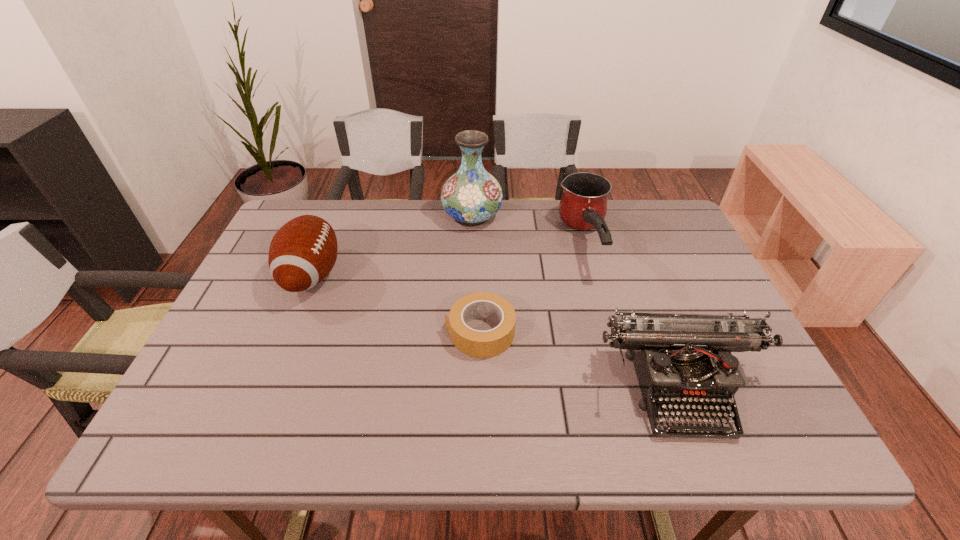
The image size is (960, 540). In the image, there is a desktop. In order to click on vacant space at the left edge in this screenshot , I will do `click(247, 287)`.

Locate an element on the screen. Image resolution: width=960 pixels, height=540 pixels. vacant region at the far right corner of the desktop is located at coordinates (668, 211).

Identify the location of free spot between the duct tape and the saucepan. The image size is (960, 540). (533, 287).

At what (x,y) coordinates should I click in order to perform the action: click on free space between the duct tape and the tallest object. Please return your answer as a coordinate pair (x, y). The image size is (960, 540). Looking at the image, I should click on (476, 274).

In order to click on free space between the saucepan and the leftmost object in this screenshot , I will do pos(448,259).

Where is `vacant area that lies between the typewriter and the tallest object`? The width and height of the screenshot is (960, 540). vacant area that lies between the typewriter and the tallest object is located at coordinates (577, 301).

I want to click on free space between the leftmost object and the tallest object, so click(392, 246).

This screenshot has width=960, height=540. I want to click on empty location between the saucepan and the tallest object, so click(x=529, y=230).

The width and height of the screenshot is (960, 540). Identify the location of vacant area that lies between the tallest object and the football. (392, 246).

Identify the location of object that is the fourth closest to the saucepan. (303, 251).